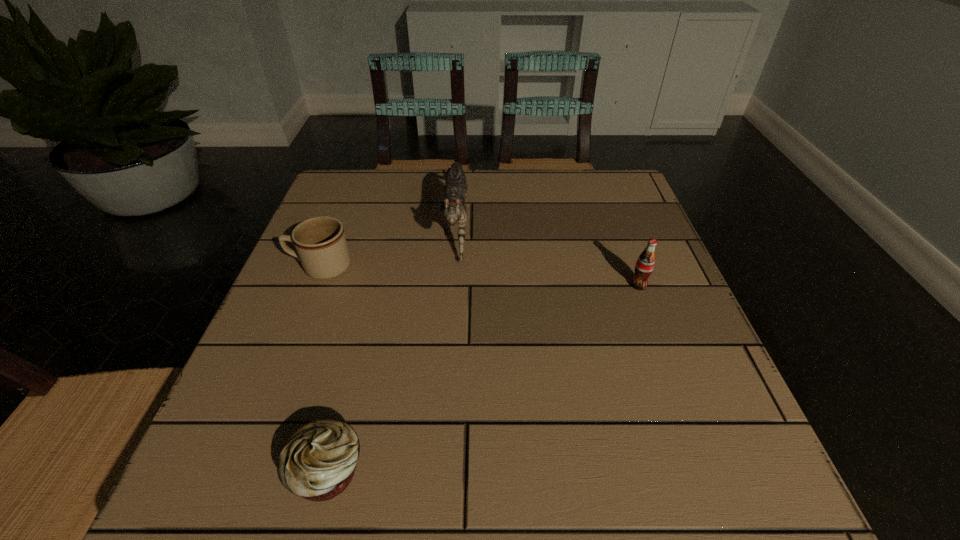
You are a GUI agent. You are given a task and a screenshot of the screen. Output one action in this format:
    pyautogui.click(x=<x>, y=<y>)
    Task: Click on the vacant space that is in between the tallest object and the soda
    The width and height of the screenshot is (960, 540).
    Given the screenshot: What is the action you would take?
    pyautogui.click(x=547, y=253)

Identify the location of free area in between the third object from left to right and the rightmost object. This screenshot has width=960, height=540. point(547,253).

Choose which object is the third nearest neighbor to the shortest object. Please provide its 2D coordinates. Your answer should be formatted as a tuple, i.e. [(x, y)], where the tuple contains the x and y coordinates of a point satisfying the conditions above.

[(645, 263)]

Locate which object is the closest to the cat. Please provide its 2D coordinates. Your answer should be formatted as a tuple, i.e. [(x, y)], where the tuple contains the x and y coordinates of a point satisfying the conditions above.

[(320, 242)]

Identify the location of blank area in the image that satisfies the following two spatial constraints: 1. on the face of the third object from left to right; 2. on the left side of the soda. (452, 285).